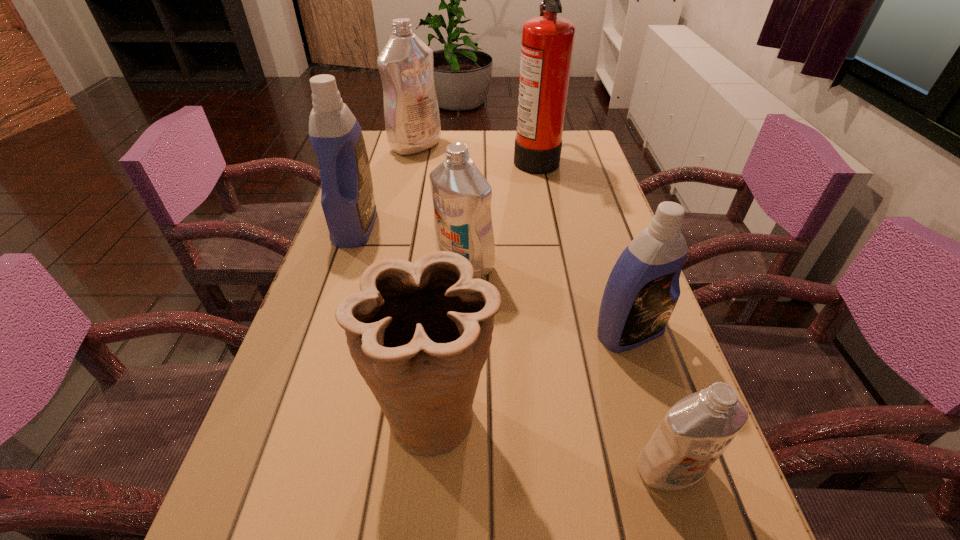
The image size is (960, 540). I want to click on the tallest object, so click(547, 45).

Find the location of a particular element. fire extinguisher is located at coordinates (547, 45).

Locate an element on the screen. This screenshot has height=540, width=960. the farthest white detergent is located at coordinates (412, 120).

Locate an element on the screen. the leftmost white detergent is located at coordinates (412, 120).

What are the coordinates of `the left blue detergent` in the screenshot? It's located at (347, 197).

Locate an element on the screen. The width and height of the screenshot is (960, 540). the farther blue detergent is located at coordinates (347, 197).

You are a GUI agent. You are given a task and a screenshot of the screen. Output one action in this format:
    pyautogui.click(x=<x>, y=<y>)
    Task: Click on the third detergent from right to left
    The height and width of the screenshot is (540, 960).
    Given the screenshot: What is the action you would take?
    pyautogui.click(x=461, y=195)

Locate an element on the screen. the second biggest white detergent is located at coordinates (461, 195).

You are a GUI agent. You are given a task and a screenshot of the screen. Output one action in this format:
    pyautogui.click(x=<x>, y=<y>)
    Task: Click on the second nearest detergent
    Image resolution: width=960 pixels, height=540 pixels.
    Given the screenshot: What is the action you would take?
    pyautogui.click(x=643, y=288)

Find the location of a particular element. The image size is (960, 540). the third nearest object is located at coordinates (643, 288).